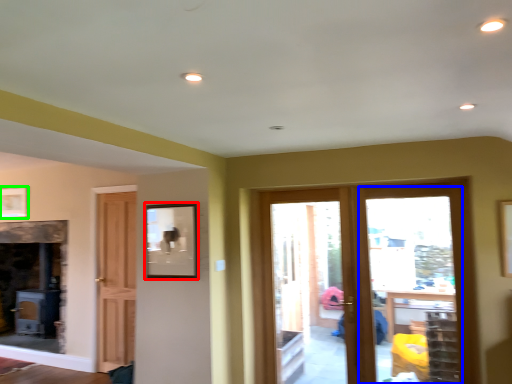
Question: Estimate the real-world distances between objects in this image. Which object is farther from picture frame (highlighted by a red box), glass door (highlighted by a blue box) or picture frame (highlighted by a green box)?

Choices:
 (A) glass door
 (B) picture frame

Answer: (B)